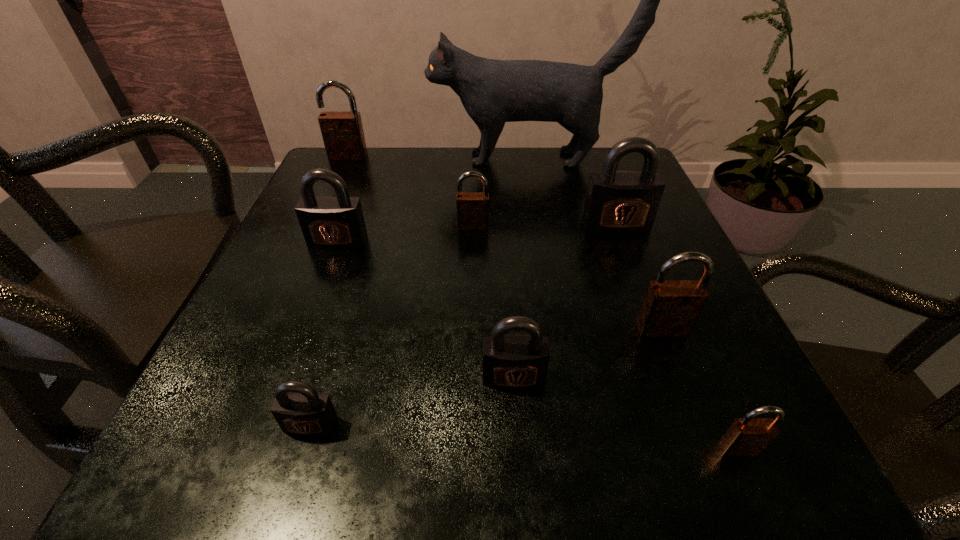
Image resolution: width=960 pixels, height=540 pixels. In order to click on empty location between the farthest brown padlock and the nearest object in this screenshot , I will do `click(543, 302)`.

Image resolution: width=960 pixels, height=540 pixels. I want to click on blank region between the nearest object and the farthest padlock, so click(x=543, y=302).

The height and width of the screenshot is (540, 960). I want to click on empty space that is in between the third nearest brown padlock and the biggest gray padlock, so (544, 225).

Locate an element on the screen. This screenshot has width=960, height=540. vacant area that lies between the second nearest object and the third nearest object is located at coordinates (412, 401).

Identify the location of free space between the rightmost gray padlock and the second biggest gray padlock. The width and height of the screenshot is (960, 540). (477, 233).

Identify which object is the nearest to the rightmost gray padlock. Please provide its 2D coordinates. Your answer should be formatted as a tuple, i.e. [(x, y)], where the tuple contains the x and y coordinates of a point satisfying the conditions above.

[(493, 92)]

The width and height of the screenshot is (960, 540). Identify the location of object that ranks as the third closest to the nearest brown padlock. (619, 202).

Where is `the second closest padlock to the cat`? The height and width of the screenshot is (540, 960). the second closest padlock to the cat is located at coordinates (619, 202).

The height and width of the screenshot is (540, 960). Identify the location of padlock that is the third closest to the second farthest brown padlock. (510, 361).

Point out which gray padlock is positioned as the second nearest to the smallest brown padlock. Please provide its 2D coordinates. Your answer should be formatted as a tuple, i.e. [(x, y)], where the tuple contains the x and y coordinates of a point satisfying the conditions above.

[(619, 202)]